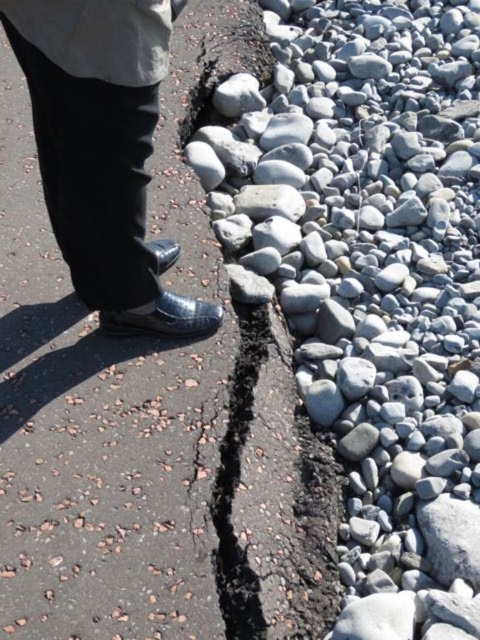
From the picture: Between shiny leather shoes at left and white fabric trench coat at upper left, which one appears on the right side from the viewer's perspective?

Positioned to the right is shiny leather shoes at left.

Between shiny leather shoes at left and white fabric trench coat at upper left, which one has more height?

shiny leather shoes at left is taller.

Measure the distance between point (94, 28) and camera.

A distance of 4.89 feet exists between point (94, 28) and camera.

The height and width of the screenshot is (640, 480). What are the coordinates of `shiny leather shoes at left` in the screenshot? It's located at (103, 150).

Describe the element at coordinates (154, 417) in the screenshot. Image resolution: width=480 pixels, height=640 pixels. I see `black asphalt crack at center` at that location.

Who is lower down, black asphalt crack at center or white fabric trench coat at upper left?

black asphalt crack at center is lower down.

Between point (0, 176) and point (51, 28), which one is positioned behind?

The point (0, 176) is behind.

Find the location of a particular element. Image resolution: width=480 pixels, height=640 pixels. black asphalt crack at center is located at coordinates (154, 417).

Is point (320, 598) farther from viewer compared to point (128, 257)?

No, (320, 598) is closer to viewer.

Which is in front, point (72, 582) or point (99, 218)?

Point (72, 582)

Is point (64, 582) positioned behind point (158, 42)?

Yes, it is.

Identify the location of black asphalt crack at center. (154, 417).